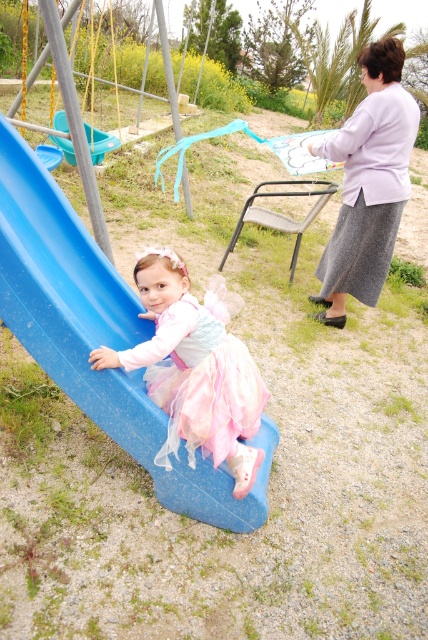
You are a photographer setting up for a photoshoot at the playground. You want to position the pastel tulle dress at lower left and the teal plastic swing at upper left in your shot. Based on their positions, which object is closer to the right side of the frame?

The pastel tulle dress at lower left is to the right of the teal plastic swing at upper left, so the pastel tulle dress at lower left is closer to the right side of the frame.

You are a photographer trying to capture both the light purple fabric skirt at upper right and the teal plastic swing at upper left in the same frame. Which object should you focus on first to ensure both are in the frame?

The light purple fabric skirt at upper right has a lesser width compared to the teal plastic swing at upper left, so you should focus on the teal plastic swing at upper left first to ensure both fit in the frame.